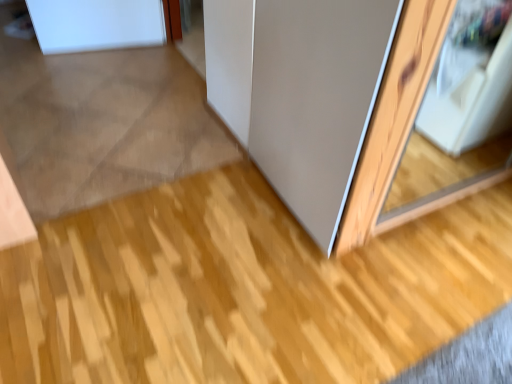
Find the location of a particular element. matte wood screen door at center is located at coordinates (317, 99).

The image size is (512, 384). Describe the element at coordinates (317, 99) in the screenshot. I see `matte wood screen door at center` at that location.

Where is `matte wood screen door at center`? Image resolution: width=512 pixels, height=384 pixels. matte wood screen door at center is located at coordinates (317, 99).